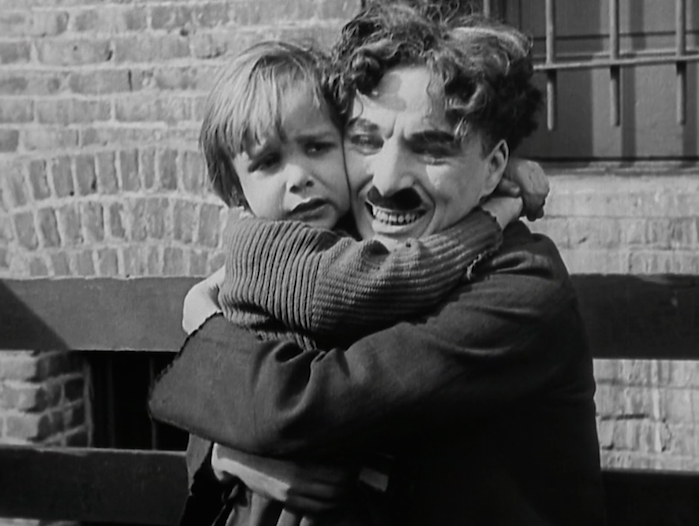
Identify the location of window. click(562, 99).